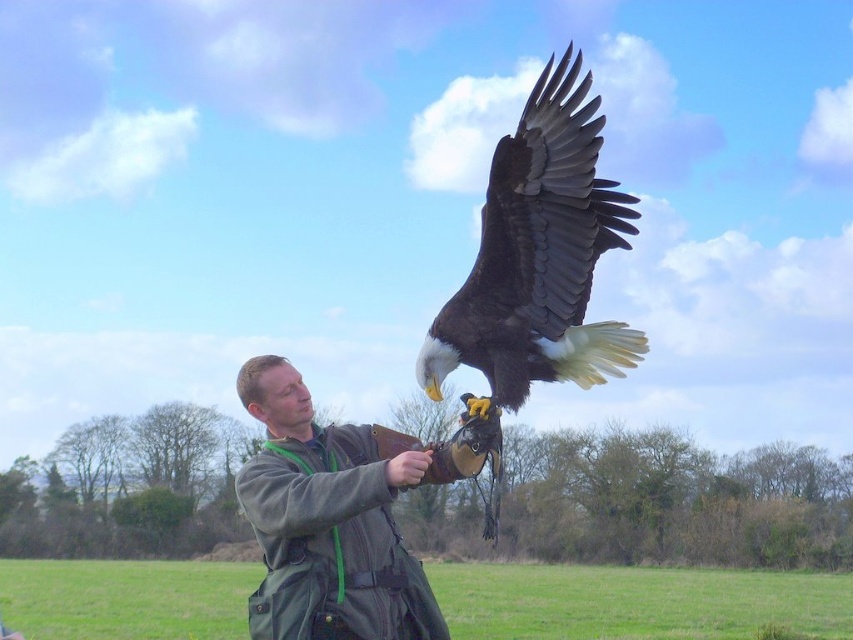
Does green fabric bag at center appear under matte brown glove at center?

Yes, green fabric bag at center is below matte brown glove at center.

Is green fabric bag at center bigger than matte brown glove at center?

Correct, green fabric bag at center is larger in size than matte brown glove at center.

Between point (55, 584) and point (403, 484), which one is positioned behind?

The point (55, 584) is more distant.

Locate an element on the screen. The image size is (853, 640). green fabric bag at center is located at coordinates (636, 602).

Who is positioned more to the left, green fabric bag at center or fuzzy gray arm at center?

green fabric bag at center is more to the left.

Between point (190, 600) and point (260, 472), which one is positioned in front?

Point (260, 472) is more forward.

You are a GUI agent. You are given a task and a screenshot of the screen. Output one action in this format:
    pyautogui.click(x=<x>, y=<y>)
    Task: Click on the green fabric bag at center
    
    Given the screenshot: What is the action you would take?
    pyautogui.click(x=636, y=602)

Between fuzzy gray arm at center and matte brown glove at center, which one is positioned lower?

fuzzy gray arm at center is lower down.

Does fuzzy gray arm at center lie behind matte brown glove at center?

No.

The image size is (853, 640). I want to click on fuzzy gray arm at center, so click(317, 490).